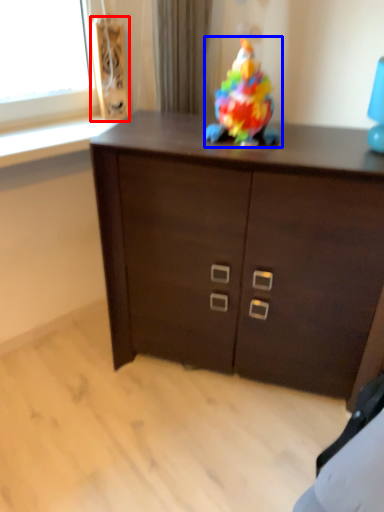
Question: Which object is further to the camera taking this photo, speaker (highlighted by a red box) or toy (highlighted by a blue box)?

Choices:
 (A) speaker
 (B) toy

Answer: (A)